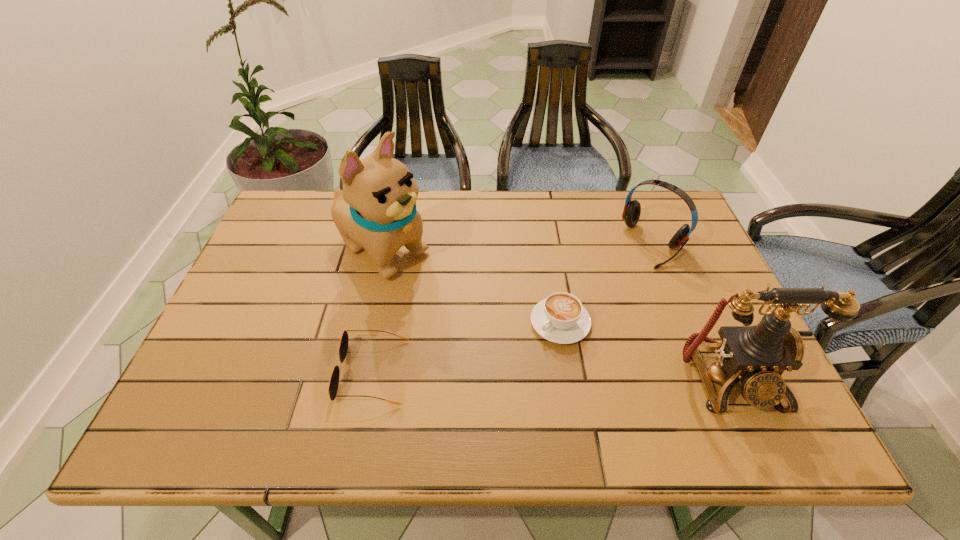
You are a GUI agent. You are given a task and a screenshot of the screen. Output one action in this format:
    pyautogui.click(x=<x>, y=<y>)
    Task: Click on the vacant space located on the face of the tallest object
    This screenshot has width=960, height=540.
    Given the screenshot: What is the action you would take?
    pyautogui.click(x=508, y=329)

The image size is (960, 540). In order to click on vacant region located with the microphone attached to the side of the third tallest object in this screenshot , I will do `click(590, 309)`.

Locate an element on the screen. vacant space located with the microphone attached to the side of the third tallest object is located at coordinates (566, 333).

You are a GUI agent. You are given a task and a screenshot of the screen. Output one action in this format:
    pyautogui.click(x=<x>, y=<y>)
    Task: Click on the vacant space located with the microphone attached to the side of the third tallest object
    
    Given the screenshot: What is the action you would take?
    click(564, 335)

This screenshot has height=540, width=960. Find the location of `vacant space located on the side of the third object from left to right with the handle`. vacant space located on the side of the third object from left to right with the handle is located at coordinates (488, 382).

You are a GUI agent. You are given a task and a screenshot of the screen. Output one action in this format:
    pyautogui.click(x=<x>, y=<y>)
    Task: Click on the puppy present at the far edge
    
    Given the screenshot: What is the action you would take?
    pyautogui.click(x=376, y=210)

Where is `headset that is at the far edge`? headset that is at the far edge is located at coordinates (632, 209).

Image resolution: width=960 pixels, height=540 pixels. I want to click on sunglasses located at the near edge, so click(344, 342).

The image size is (960, 540). I want to click on telephone that is positioned at the near edge, so click(758, 355).

This screenshot has width=960, height=540. I want to click on telephone that is at the right edge, so click(758, 355).